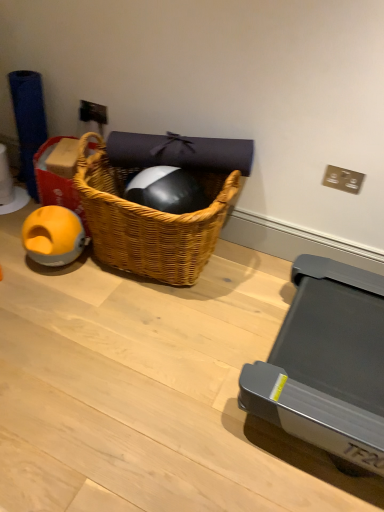
What do you see at coordinates (56, 184) in the screenshot?
I see `yellow rubber ball at left` at bounding box center [56, 184].

Measure the distance between woven wood picnic basket at center and camera.

A distance of 5.00 feet exists between woven wood picnic basket at center and camera.

Where is `metallic silver power outlet at upper center`? metallic silver power outlet at upper center is located at coordinates (93, 112).

What is the approximate height of metallic silver power outlet at upper center?

It is 3.98 inches.

Where is `yellow rubber ball at left`? yellow rubber ball at left is located at coordinates (56, 184).

Which object is closer to the camera, woven wood picnic basket at center or orange rubber ball at left?

woven wood picnic basket at center is in front.

Is woven wood picnic basket at center positioned beyond the bounds of orange rubber ball at left?

Yes, woven wood picnic basket at center is not within orange rubber ball at left.

Is woven wood picnic basket at center placed right next to orange rubber ball at left?

They are not placed beside each other.

From a real-world perspective, is orange rubber ball at left physically located above or below woven wood picnic basket at center?

orange rubber ball at left is below woven wood picnic basket at center.

Considering the relative positions of orange rubber ball at left and woven wood picnic basket at center in the image provided, is orange rubber ball at left to the left of woven wood picnic basket at center from the viewer's perspective?

Yes.

You are a GUI agent. You are given a task and a screenshot of the screen. Output one action in this format:
    pyautogui.click(x=<x>, y=<y>)
    Task: Click on the toy behind the woven wood picnic basket at center
    The height and width of the screenshot is (512, 384).
    Given the screenshot: What is the action you would take?
    pyautogui.click(x=53, y=236)

From the picture: Can you confirm if orange rubber ball at left is taller than woven wood picnic basket at center?

In fact, orange rubber ball at left may be shorter than woven wood picnic basket at center.

From the picture: Looking at their sizes, would you say orange rubber ball at left is wider or thinner than yellow rubber ball at left?

Considering their sizes, orange rubber ball at left looks slimmer than yellow rubber ball at left.

How many degrees apart are the facing directions of orange rubber ball at left and yellow rubber ball at left?

7.12e-05 degrees.

Considering the sizes of orange rubber ball at left and yellow rubber ball at left in the image, is orange rubber ball at left taller or shorter than yellow rubber ball at left?

In the image, orange rubber ball at left appears to be shorter than yellow rubber ball at left.

Is orange rubber ball at left to the left or to the right of yellow rubber ball at left in the image?

Clearly, orange rubber ball at left is on the left of yellow rubber ball at left in the image.

How much distance is there between metallic silver power outlet at upper center and woven wood picnic basket at center?

metallic silver power outlet at upper center and woven wood picnic basket at center are 23.57 inches apart.

Is metallic silver power outlet at upper center wider or thinner than woven wood picnic basket at center?

metallic silver power outlet at upper center is thinner than woven wood picnic basket at center.

Consider the image. Does metallic silver power outlet at upper center have a larger size compared to woven wood picnic basket at center?

No.

From the image's perspective, which one is positioned lower, metallic silver power outlet at upper center or woven wood picnic basket at center?

woven wood picnic basket at center.

From a real-world perspective, is orange rubber ball at left positioned under metallic silver power outlet at upper center based on gravity?

Yes.

Does orange rubber ball at left appear on the left side of metallic silver power outlet at upper center?

Correct, you'll find orange rubber ball at left to the left of metallic silver power outlet at upper center.

Which is farther, (40, 232) or (79, 114)?

The point (79, 114) is farther.

The image size is (384, 512). Find the location of `box above the woven wood picnic basket at center (from the image's perspective)`. box above the woven wood picnic basket at center (from the image's perspective) is located at coordinates (56, 184).

From the image's perspective, who appears lower, yellow rubber ball at left or woven wood picnic basket at center?

woven wood picnic basket at center.

What's the angular difference between yellow rubber ball at left and woven wood picnic basket at center's facing directions?

yellow rubber ball at left and woven wood picnic basket at center are facing 1.99e-05 degrees away from each other.

Identify the location of power outlet behind the woven wood picnic basket at center. (93, 112).

Is the depth of woven wood picnic basket at center greater than that of metallic silver power outlet at upper center?

No, it is not.

From a real-world perspective, is woven wood picnic basket at center above or below metallic silver power outlet at upper center?

woven wood picnic basket at center is situated lower than metallic silver power outlet at upper center in the real world.

Based on the photo, from the image's perspective, which is below, woven wood picnic basket at center or metallic silver power outlet at upper center?

woven wood picnic basket at center is shown below in the image.

I want to click on toy behind the woven wood picnic basket at center, so click(x=53, y=236).

Identify the location of toy below the woven wood picnic basket at center (from the image's perspective). The height and width of the screenshot is (512, 384). (53, 236).

Looking at the image, which one is located further to metallic silver power outlet at upper center, yellow rubber ball at left or orange rubber ball at left?

orange rubber ball at left is further to metallic silver power outlet at upper center.

Which object lies further to the anchor point orange rubber ball at left, yellow rubber ball at left or woven wood picnic basket at center?

The object further to orange rubber ball at left is woven wood picnic basket at center.

Considering their positions, is woven wood picnic basket at center positioned further to orange rubber ball at left than metallic silver power outlet at upper center?

metallic silver power outlet at upper center is further to orange rubber ball at left.

Considering their positions, is yellow rubber ball at left positioned further to metallic silver power outlet at upper center than woven wood picnic basket at center?

woven wood picnic basket at center is further to metallic silver power outlet at upper center.

Based on their spatial positions, is metallic silver power outlet at upper center or orange rubber ball at left closer to woven wood picnic basket at center?

orange rubber ball at left is positioned closer to the anchor woven wood picnic basket at center.

From the image, which object appears to be farther from orange rubber ball at left, metallic silver power outlet at upper center or yellow rubber ball at left?

The object further to orange rubber ball at left is metallic silver power outlet at upper center.

Based on their spatial positions, is orange rubber ball at left or metallic silver power outlet at upper center closer to woven wood picnic basket at center?

orange rubber ball at left lies closer to woven wood picnic basket at center than the other object.

From the image, which object appears to be nearer to orange rubber ball at left, yellow rubber ball at left or metallic silver power outlet at upper center?

Based on the image, yellow rubber ball at left appears to be nearer to orange rubber ball at left.

You are a GUI agent. You are given a task and a screenshot of the screen. Output one action in this format:
    pyautogui.click(x=<x>, y=<y>)
    Task: Click on the box between metallic silver power outlet at upper center and orange rubber ball at left from top to bottom
    The width and height of the screenshot is (384, 512).
    Given the screenshot: What is the action you would take?
    pyautogui.click(x=56, y=184)

The image size is (384, 512). I want to click on picnic basket between metallic silver power outlet at upper center and orange rubber ball at left in the vertical direction, so click(x=149, y=221).

This screenshot has height=512, width=384. In order to click on box between woven wood picnic basket at center and metallic silver power outlet at upper center along the z-axis in this screenshot , I will do `click(56, 184)`.

This screenshot has width=384, height=512. Find the location of `box situated between orange rubber ball at left and woven wood picnic basket at center from left to right`. box situated between orange rubber ball at left and woven wood picnic basket at center from left to right is located at coordinates (56, 184).